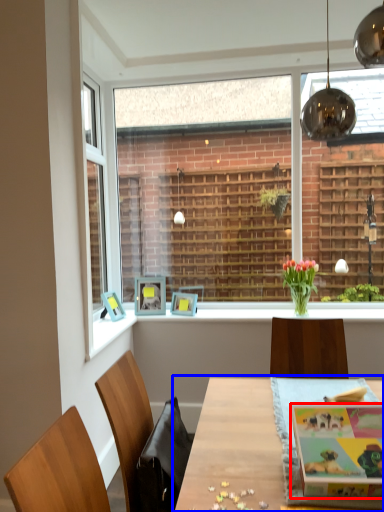
Question: Which object is closer to the camera taking this photo, magazine (highlighted by a red box) or table (highlighted by a blue box)?

Choices:
 (A) magazine
 (B) table

Answer: (B)